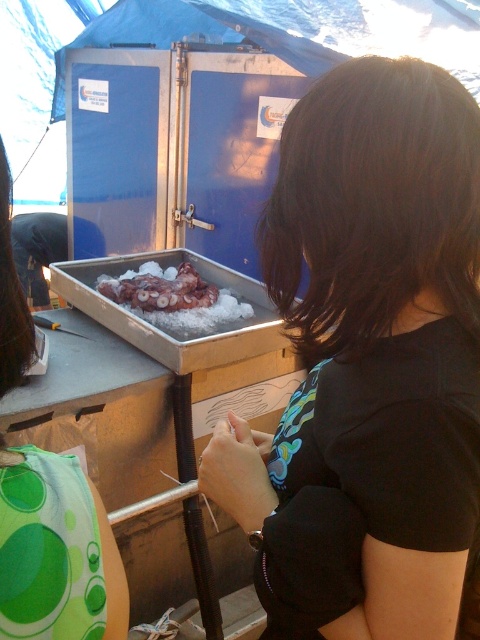
Question: Which object is farther from the camera taking this photo?

Choices:
 (A) reddish-brown gelatinous octopus at center
 (B) black matte shirt at center

Answer: (A)

Question: Does black matte shirt at center have a larger size compared to reddish-brown gelatinous octopus at center?

Choices:
 (A) yes
 (B) no

Answer: (A)

Question: Which point is closer to the camera taking this photo?

Choices:
 (A) (277, 454)
 (B) (202, 285)

Answer: (A)

Question: Is black matte shirt at center positioned behind reddish-brown gelatinous octopus at center?

Choices:
 (A) no
 (B) yes

Answer: (A)

Question: In this image, where is black matte shirt at center located relative to reddish-brown gelatinous octopus at center?

Choices:
 (A) below
 (B) above

Answer: (A)